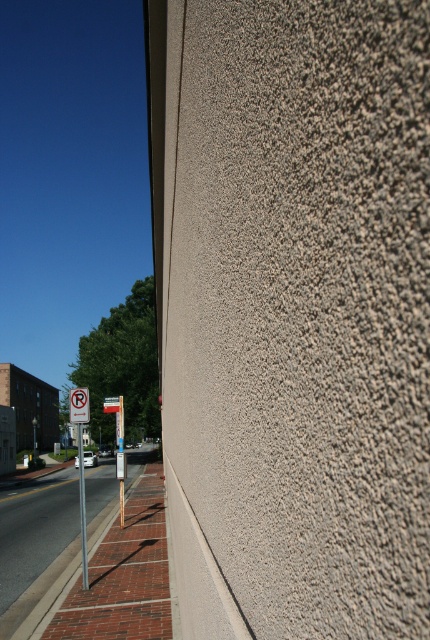
Does point (82, 433) come closer to viewer compared to point (88, 403)?

No.

In the scene shown: Which is below, metallic pole at left or white plastic sign at upper left?

Positioned lower is metallic pole at left.

Which is in front, point (80, 515) or point (89, 416)?

Positioned in front is point (89, 416).

Find the location of a particular element. metallic pole at left is located at coordinates (82, 508).

Does brick pavement at lower left appear on the right side of metallic pole at left?

Incorrect, brick pavement at lower left is not on the right side of metallic pole at left.

Consider the image. Is brick pavement at lower left to the left of metallic pole at left from the viewer's perspective?

Yes, brick pavement at lower left is to the left of metallic pole at left.

Where is `brick pavement at lower left`? brick pavement at lower left is located at coordinates (34, 531).

Image resolution: width=430 pixels, height=640 pixels. I want to click on brick pavement at lower left, so coord(34,531).

The image size is (430, 640). Describe the element at coordinates (34, 531) in the screenshot. I see `brick pavement at lower left` at that location.

Does brick pavement at lower left have a lesser height compared to white plastic sign at upper left?

No, brick pavement at lower left is not shorter than white plastic sign at upper left.

Locate an element on the screen. brick pavement at lower left is located at coordinates (34, 531).